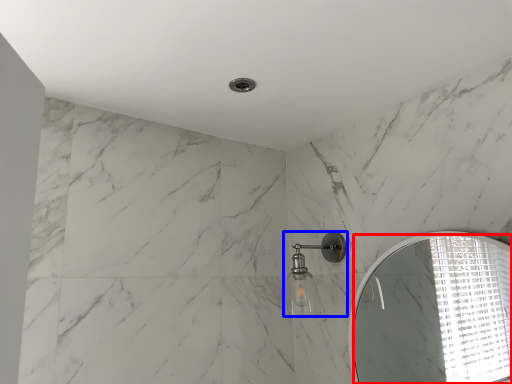
Question: Which object appears closest to the camera in this image, mirror (highlighted by a red box) or shower (highlighted by a blue box)?

Choices:
 (A) mirror
 (B) shower

Answer: (A)